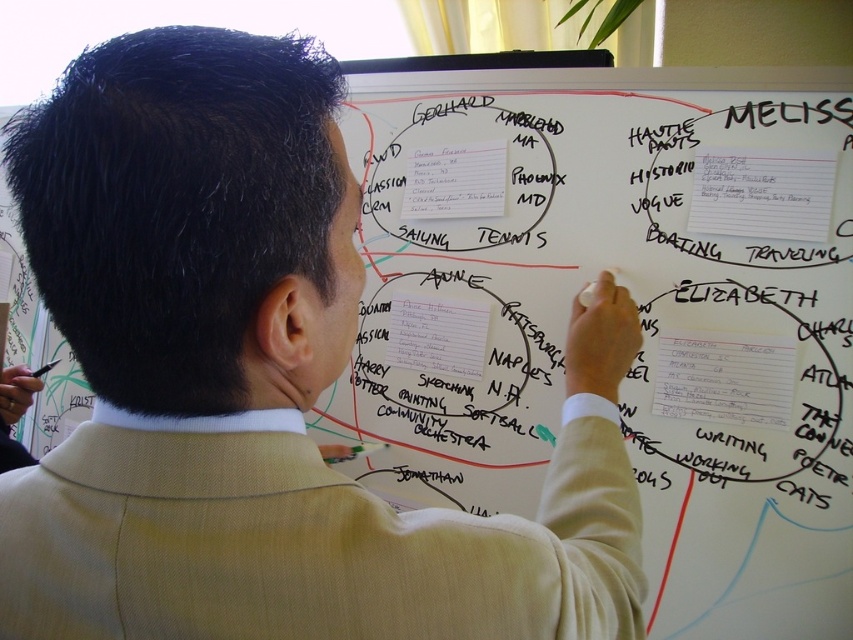
You are organizing a team meeting and need to place a 8.5 inches wide flipchart next to the white paperboard at center and white paper at center. Can the flipchart fit between them without overlapping?

The white paperboard at center and white paper at center are 7.99 inches apart from each other. Since the flipchart is 8.5 inches wide, it cannot fit between them without overlapping as the space is slightly smaller than the flipchart.

From the picture: What is located at the coordinates point [636,301]?

The point [636,301] marks the white paperboard at center.

You are a tailor who needs to adjust the beige wool suit at center to fit a client. The client mentions they want the suit to be as wide as the white paper at center. Can you achieve this by narrowing the suit?

The beige wool suit at center is currently wider than the white paper at center. By narrowing the suit, it can be adjusted to match the width of the white paper at center.